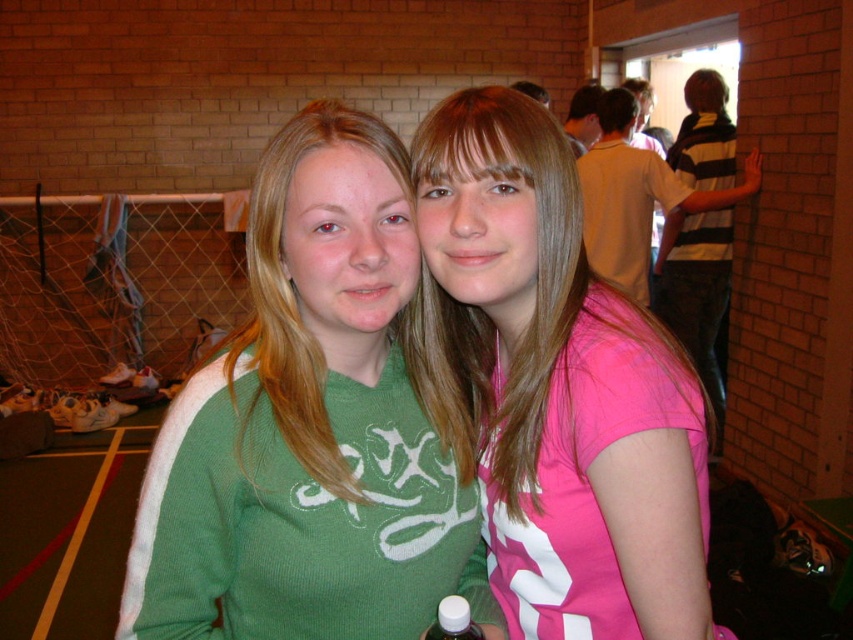
Identify the location of green ribbed sweater at center. Image resolution: width=853 pixels, height=640 pixels. (312, 426).

Is green ribbed sweater at center thinner than yellow matte shirt at upper right?

Correct, green ribbed sweater at center's width is less than yellow matte shirt at upper right's.

Does point (259, 500) come behind point (695, 192)?

No, it is in front of (695, 192).

You are a GUI agent. You are given a task and a screenshot of the screen. Output one action in this format:
    pyautogui.click(x=<x>, y=<y>)
    Task: Click on the green ribbed sweater at center
    
    Given the screenshot: What is the action you would take?
    pyautogui.click(x=312, y=426)

Is green ribbed sweater at center shorter than pink matte shirt at center?

Correct, green ribbed sweater at center is not as tall as pink matte shirt at center.

What do you see at coordinates (312, 426) in the screenshot?
I see `green ribbed sweater at center` at bounding box center [312, 426].

Where is `green ribbed sweater at center`? The image size is (853, 640). green ribbed sweater at center is located at coordinates (312, 426).

Is pink matte shirt at center closer to the viewer compared to yellow matte shirt at upper right?

Yes, pink matte shirt at center is closer to the viewer.

Who is more distant from viewer, (579, 461) or (621, 148)?

The point (621, 148) is more distant.

Image resolution: width=853 pixels, height=640 pixels. Identify the location of pink matte shirt at center. (560, 387).

This screenshot has width=853, height=640. Identify the location of pink matte shirt at center. (560, 387).